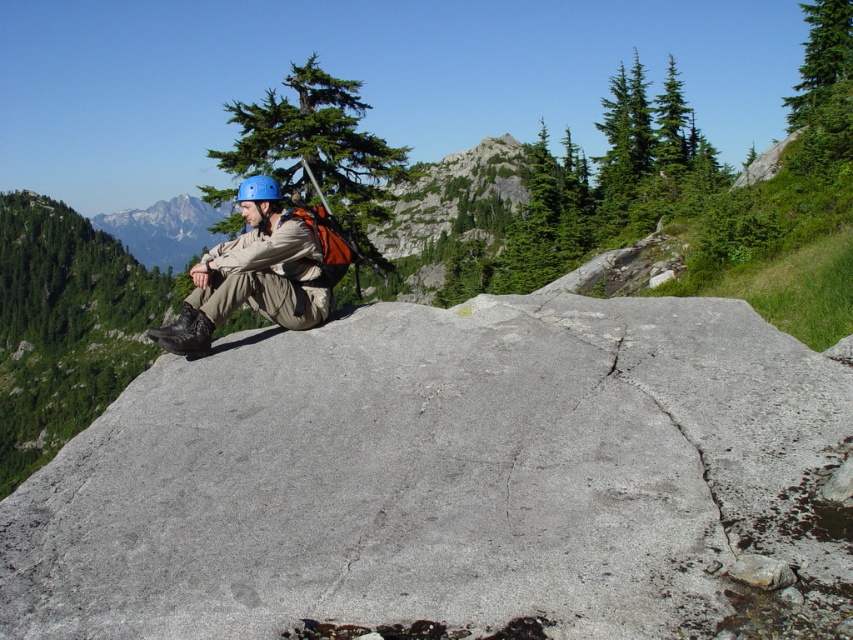
Question: Can you confirm if gray rough rock at center is positioned to the right of matte gray rock at center?

Choices:
 (A) no
 (B) yes

Answer: (B)

Question: Based on their relative distances, which object is farther from the gray rough rock at center?

Choices:
 (A) matte blue helmet at center
 (B) matte gray rock at center

Answer: (B)

Question: Where is gray rough rock at center located in relation to matte blue helmet at center in the image?

Choices:
 (A) above
 (B) below

Answer: (B)

Question: From the image, what is the correct spatial relationship of matte blue helmet at center in relation to matte gray rock at center?

Choices:
 (A) above
 (B) below

Answer: (B)

Question: Estimate the real-world distances between objects in this image. Which object is closer to the matte gray rock at center?

Choices:
 (A) matte blue helmet at center
 (B) gray rough rock at center

Answer: (B)

Question: Among these objects, which one is nearest to the camera?

Choices:
 (A) gray rough rock at center
 (B) matte gray rock at center
 (C) matte blue helmet at center

Answer: (A)